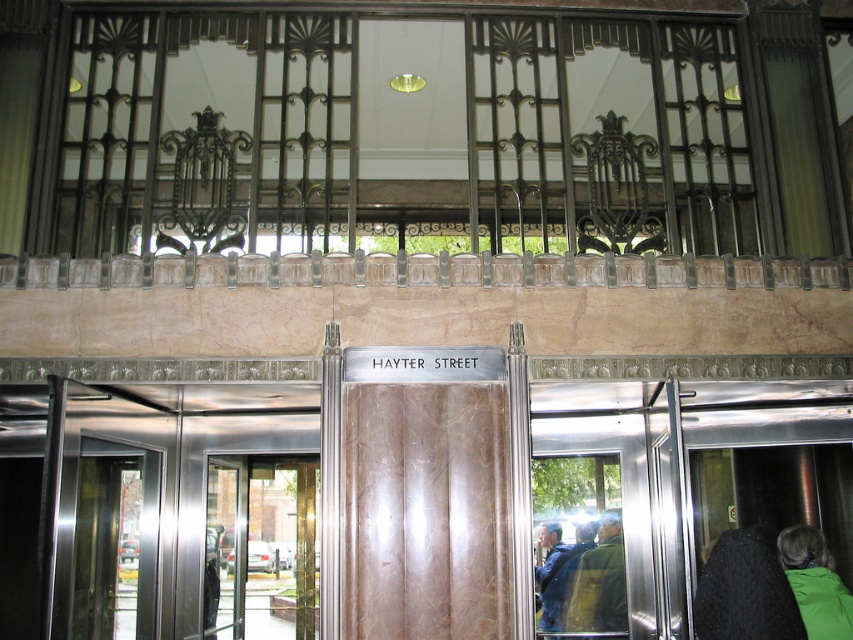
Question: Can you confirm if black knitted sweater at lower right is positioned above green fabric jacket at center?

Choices:
 (A) no
 (B) yes

Answer: (B)

Question: Which point is closer to the camera?

Choices:
 (A) green fabric jacket at center
 (B) black knitted sweater at lower right

Answer: (B)

Question: Considering the relative positions of black knitted sweater at lower right and green fabric jacket at center in the image provided, where is black knitted sweater at lower right located with respect to green fabric jacket at center?

Choices:
 (A) right
 (B) left

Answer: (A)

Question: Does transparent glass door at center appear on the right side of blue denim jacket at lower right?

Choices:
 (A) no
 (B) yes

Answer: (A)

Question: Estimate the real-world distances between objects in this image. Which object is closer to the transparent glass door at center?

Choices:
 (A) green fabric jacket at center
 (B) black knitted sweater at lower right
 (C) green matte jacket at lower right

Answer: (A)

Question: Estimate the real-world distances between objects in this image. Which object is closer to the blue denim jacket at lower right?

Choices:
 (A) transparent glass door at center
 (B) black knitted sweater at lower right

Answer: (A)